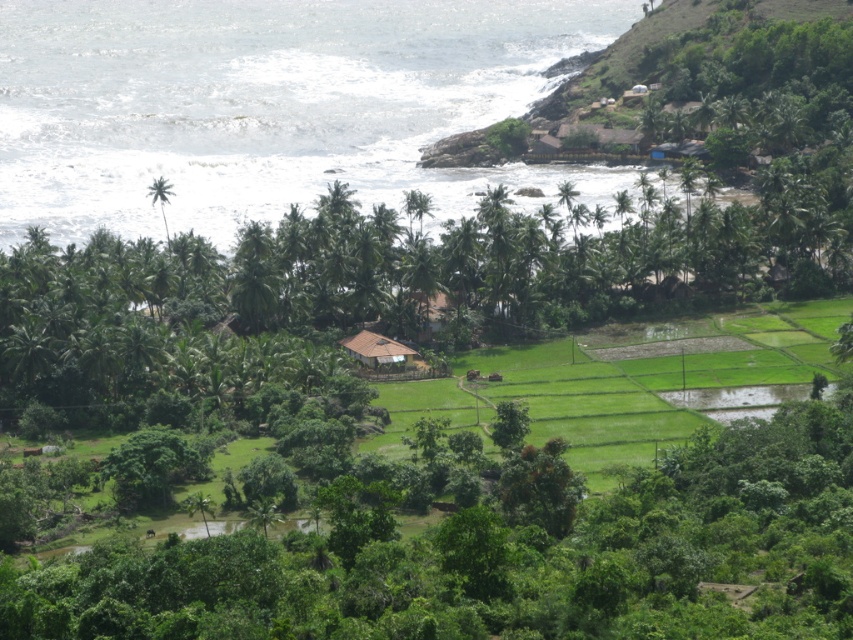
You are a drone operator tasked with capturing aerial footage of the brown thatched hut at center. The drone must maintain a minimum altitude of 10 meters to avoid detection. Given the elevation of the area, can the drone safely fly at this altitude without crashing into any obstacles?

The brown thatched hut at center is located at point [381,353], but without specific elevation data for the terrain or the height of the hut itself, it is impossible to determine if the drone can safely maintain a 10 meter altitude. Additional information about the local terrain elevation and the hut height is required to assess safety.

You are a tourist standing at the beach and want to take a photo of the brown thatched hut at center. However, there is white frothy water at upper left in the way. Can you move to a position where the hut is visible without the water blocking it?

The white frothy water at upper left is above the brown thatched hut at center, so if you move to a lower position relative to the hut, you might be able to see it below the water.

In the scene shown: You are a tourist planning to take a photo of the white frothy water at upper left and the brown thatched hut at center. Which object should you focus on first if you want to capture both in a single frame without zooming in or out?

You should focus on the white frothy water at upper left first because it is larger than the brown thatched hut at center, making it easier to frame both objects without zooming.